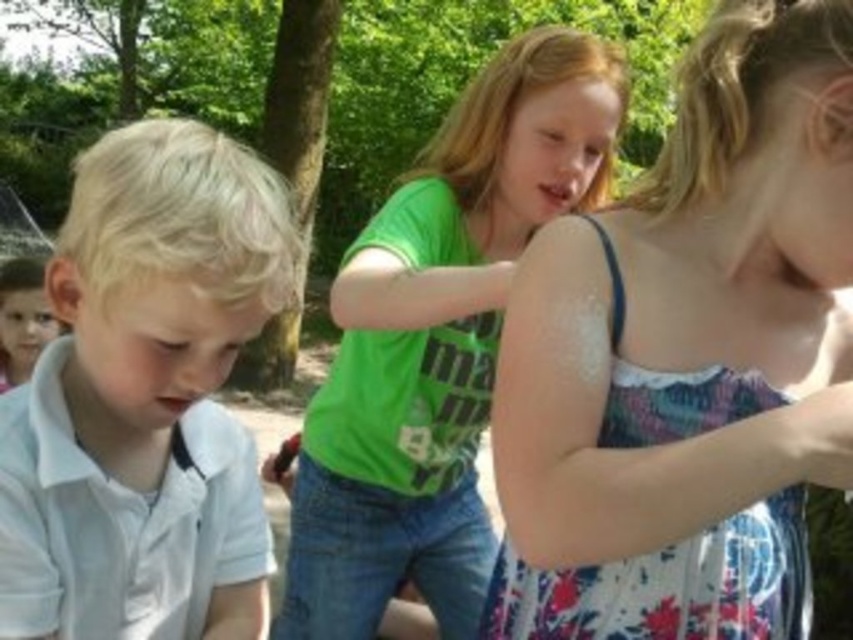
Which is more to the right, floral dress at upper right or green matte shirt at center?

From the viewer's perspective, floral dress at upper right appears more on the right side.

From the picture: Between floral dress at upper right and green matte shirt at center, which one is positioned higher?

floral dress at upper right is higher up.

Where is `floral dress at upper right`? Image resolution: width=853 pixels, height=640 pixels. floral dress at upper right is located at coordinates (688, 356).

This screenshot has width=853, height=640. What do you see at coordinates (688, 356) in the screenshot?
I see `floral dress at upper right` at bounding box center [688, 356].

In order to click on floral dress at upper right in this screenshot , I will do `click(688, 356)`.

Which is behind, point (231, 426) or point (357, 358)?

The point (357, 358) is more distant.

Is white matte shirt at left positioned at the back of green matte shirt at center?

That is False.

At what (x,y) coordinates should I click in order to perform the action: click on white matte shirt at left. Please return your answer as a coordinate pair (x, y). This screenshot has width=853, height=640. Looking at the image, I should click on (144, 397).